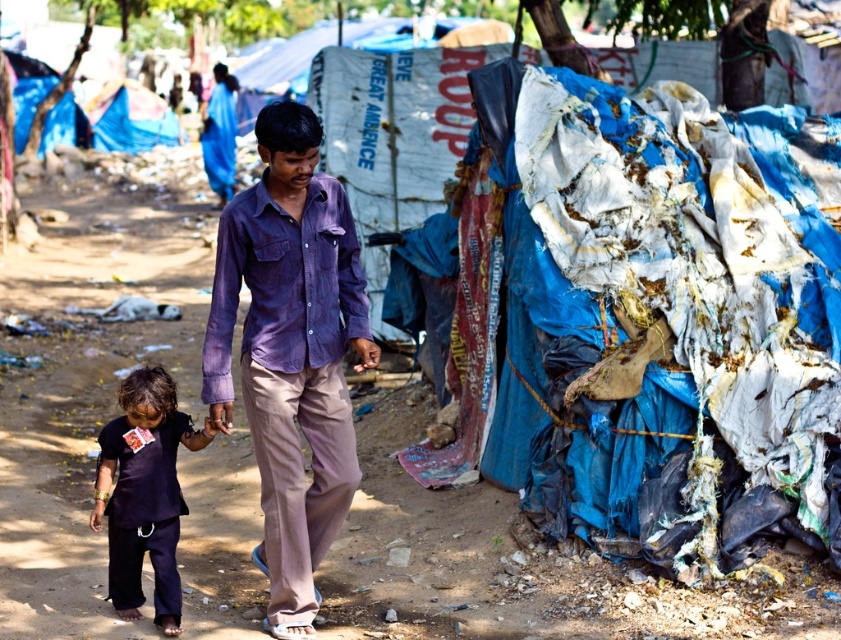
Question: Considering the relative positions of purple corduroy shirt at center and purple cotton shirt at center in the image provided, where is purple corduroy shirt at center located with respect to purple cotton shirt at center?

Choices:
 (A) above
 (B) below

Answer: (B)

Question: Can you confirm if purple corduroy shirt at center is wider than purple cotton shirt at center?

Choices:
 (A) yes
 (B) no

Answer: (A)

Question: Which point is farther to the camera?

Choices:
 (A) (229, 289)
 (B) (120, 388)
 (C) (776, 362)
 (D) (266, 484)

Answer: (C)

Question: Which point appears farthest from the camera in this image?

Choices:
 (A) (311, 196)
 (B) (776, 301)
 (C) (165, 627)
 (D) (305, 305)

Answer: (B)

Question: Which object is closer to the camera taking this photo?

Choices:
 (A) dark blue fabric at center
 (B) ragged plastic bags at right

Answer: (A)

Question: Does ragged plastic bags at right appear over purple corduroy shirt at center?

Choices:
 (A) yes
 (B) no

Answer: (A)